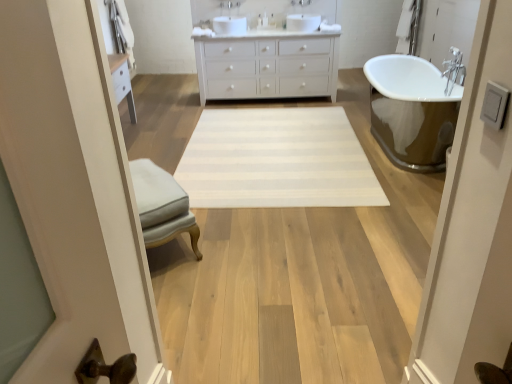
Question: Does light gray fabric ottoman at center have a greater height compared to white striped rug at center?

Choices:
 (A) yes
 (B) no

Answer: (A)

Question: Would you say light gray fabric ottoman at center is a long distance from white striped rug at center?

Choices:
 (A) no
 (B) yes

Answer: (B)

Question: Does light gray fabric ottoman at center turn towards white striped rug at center?

Choices:
 (A) no
 (B) yes

Answer: (B)

Question: Does light gray fabric ottoman at center have a larger size compared to white striped rug at center?

Choices:
 (A) yes
 (B) no

Answer: (B)

Question: Is light gray fabric ottoman at center with white striped rug at center?

Choices:
 (A) yes
 (B) no

Answer: (B)

Question: From the image's perspective, is light gray fabric ottoman at center above or below white matte cabinet at center?

Choices:
 (A) above
 (B) below

Answer: (B)

Question: Would you say light gray fabric ottoman at center is to the left or to the right of white matte cabinet at center in the picture?

Choices:
 (A) right
 (B) left

Answer: (B)

Question: Is light gray fabric ottoman at center taller or shorter than white matte cabinet at center?

Choices:
 (A) tall
 (B) short

Answer: (B)

Question: Considering the positions of point (178, 226) and point (256, 96), is point (178, 226) closer or farther from the camera than point (256, 96)?

Choices:
 (A) farther
 (B) closer

Answer: (B)

Question: From the image's perspective, is white striped rug at center above or below light gray fabric ottoman at center?

Choices:
 (A) below
 (B) above

Answer: (B)

Question: Is white striped rug at center inside or outside of light gray fabric ottoman at center?

Choices:
 (A) inside
 (B) outside

Answer: (B)

Question: In the image, is white striped rug at center positioned in front of or behind light gray fabric ottoman at center?

Choices:
 (A) behind
 (B) front

Answer: (A)

Question: Visually, is white striped rug at center positioned to the left or to the right of light gray fabric ottoman at center?

Choices:
 (A) right
 (B) left

Answer: (A)

Question: Looking at their shapes, would you say white matte cabinet at center is wider or thinner than white striped rug at center?

Choices:
 (A) thin
 (B) wide

Answer: (A)

Question: Is point (271, 39) closer or farther from the camera than point (236, 132)?

Choices:
 (A) farther
 (B) closer

Answer: (A)